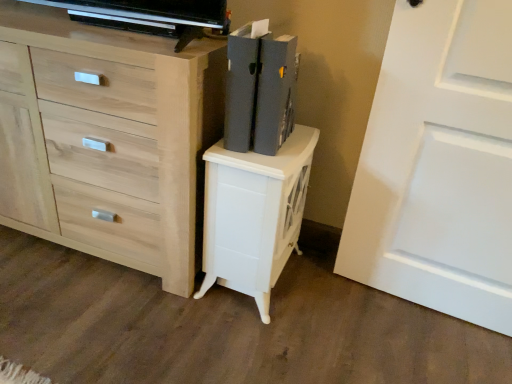
Where is `light wood chest of drawers at center`? This screenshot has width=512, height=384. light wood chest of drawers at center is located at coordinates (106, 139).

In order to face white glossy nightstand at center, should I rotate leftwards or rightwards?

Rotate right and turn 1.140 degrees.

Where is `light wood chest of drawers at center`? The height and width of the screenshot is (384, 512). light wood chest of drawers at center is located at coordinates (106, 139).

Which is more to the left, white matte door at right or light wood chest of drawers at center?

light wood chest of drawers at center is more to the left.

Between point (478, 110) and point (112, 260), which one is positioned behind?

The point (112, 260) is behind.

From a real-world perspective, is white matte door at right located beneath light wood chest of drawers at center?

Actually, white matte door at right is physically above light wood chest of drawers at center in the real world.

Considering the sizes of objects white glossy nightstand at center and white matte door at right in the image provided, who is taller, white glossy nightstand at center or white matte door at right?

Standing taller between the two is white matte door at right.

Considering the positions of points (248, 277) and (481, 57), is point (248, 277) closer to camera compared to point (481, 57)?

No, (248, 277) is behind (481, 57).

There is a white glossy nightstand at center. At what (x,y) coordinates should I click in order to perform the action: click on door above it (from a real-world perspective). Please return your answer as a coordinate pair (x, y). The width and height of the screenshot is (512, 384). Looking at the image, I should click on (439, 165).

Between white glossy nightstand at center and white matte door at right, which one has larger size?

white glossy nightstand at center.

Between matte gray book at upper right and white matte door at right, which one has smaller width?

With smaller width is white matte door at right.

How much distance is there between matte gray book at upper right and white matte door at right?

matte gray book at upper right is 18.32 inches from white matte door at right.

From the image's perspective, is matte gray book at upper right above white matte door at right?

Correct, matte gray book at upper right appears higher than white matte door at right in the image.

Considering the relative sizes of light wood chest of drawers at center and white glossy nightstand at center in the image provided, is light wood chest of drawers at center bigger than white glossy nightstand at center?

Yes, light wood chest of drawers at center is bigger than white glossy nightstand at center.

In the scene shown: Can you confirm if light wood chest of drawers at center is taller than white glossy nightstand at center?

Correct, light wood chest of drawers at center is much taller as white glossy nightstand at center.

Is there a large distance between light wood chest of drawers at center and white glossy nightstand at center?

That's not correct — light wood chest of drawers at center is a little close to white glossy nightstand at center.

Can you tell me how much white matte door at right and matte gray book at upper right differ in facing direction?

The angle between the facing direction of white matte door at right and the facing direction of matte gray book at upper right is 94 degrees.

Which is more to the right, white matte door at right or matte gray book at upper right?

Positioned to the right is white matte door at right.

Is white matte door at right far away from matte gray book at upper right?

No, white matte door at right is not far away from matte gray book at upper right.

Considering the relative sizes of white matte door at right and matte gray book at upper right in the image provided, is white matte door at right thinner than matte gray book at upper right?

Indeed, white matte door at right has a lesser width compared to matte gray book at upper right.

From the image's perspective, which is above, matte gray book at upper right or white glossy nightstand at center?

matte gray book at upper right, from the image's perspective.

Consider the image. Considering the relative sizes of matte gray book at upper right and white glossy nightstand at center in the image provided, is matte gray book at upper right shorter than white glossy nightstand at center?

Correct, matte gray book at upper right is not as tall as white glossy nightstand at center.

Considering the positions of points (254, 78) and (285, 146), is point (254, 78) farther from camera compared to point (285, 146)?

No, (254, 78) is closer to viewer.

From a real-world perspective, does white glossy nightstand at center stand above matte gray book at upper right?

No, from a real-world perspective, white glossy nightstand at center is not over matte gray book at upper right

Is white glossy nightstand at center situated inside matte gray book at upper right or outside?

white glossy nightstand at center exists outside the volume of matte gray book at upper right.

Considering the sizes of objects white glossy nightstand at center and matte gray book at upper right in the image provided, who is wider, white glossy nightstand at center or matte gray book at upper right?

white glossy nightstand at center.

Is white glossy nightstand at center aimed at matte gray book at upper right?

No, white glossy nightstand at center is not turned towards matte gray book at upper right.

Identify the location of the chest of drawers directly beneath the white matte door at right (from a real-world perspective). (106, 139).

The image size is (512, 384). I want to click on nightstand behind the white matte door at right, so click(254, 215).

Which object lies further to the anchor point white glossy nightstand at center, light wood chest of drawers at center or matte gray book at upper right?

light wood chest of drawers at center is further to white glossy nightstand at center.

Looking at the image, which one is located closer to matte gray book at upper right, white glossy nightstand at center or light wood chest of drawers at center?

white glossy nightstand at center.

When comparing their distances from matte gray book at upper right, does light wood chest of drawers at center or white matte door at right seem further?

white matte door at right is further to matte gray book at upper right.

Based on their spatial positions, is light wood chest of drawers at center or matte gray book at upper right further from white matte door at right?

The object further to white matte door at right is light wood chest of drawers at center.

Considering their positions, is matte gray book at upper right positioned closer to white glossy nightstand at center than white matte door at right?

matte gray book at upper right.

Based on their spatial positions, is light wood chest of drawers at center or white glossy nightstand at center further from matte gray book at upper right?

light wood chest of drawers at center is positioned further to the anchor matte gray book at upper right.

Considering their positions, is white matte door at right positioned further to white glossy nightstand at center than light wood chest of drawers at center?

Among the two, white matte door at right is located further to white glossy nightstand at center.

Which object lies nearer to the anchor point white matte door at right, white glossy nightstand at center or light wood chest of drawers at center?

white glossy nightstand at center is positioned closer to the anchor white matte door at right.

Find the location of a particular element. Image resolution: width=512 pixels, height=384 pixels. nightstand situated between matte gray book at upper right and white matte door at right from left to right is located at coordinates (254, 215).

Locate an element on the screen. The image size is (512, 384). book situated between light wood chest of drawers at center and white glossy nightstand at center from left to right is located at coordinates (260, 89).

Identify the location of nightstand located between light wood chest of drawers at center and white matte door at right in the left-right direction. Image resolution: width=512 pixels, height=384 pixels. (254, 215).

This screenshot has width=512, height=384. In order to click on book between light wood chest of drawers at center and white matte door at right in this screenshot , I will do `click(260, 89)`.